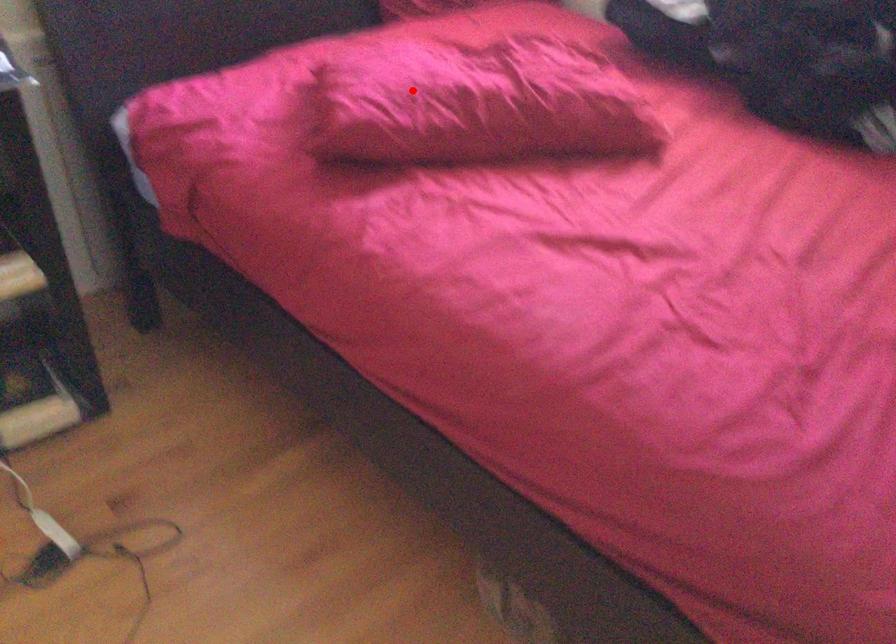
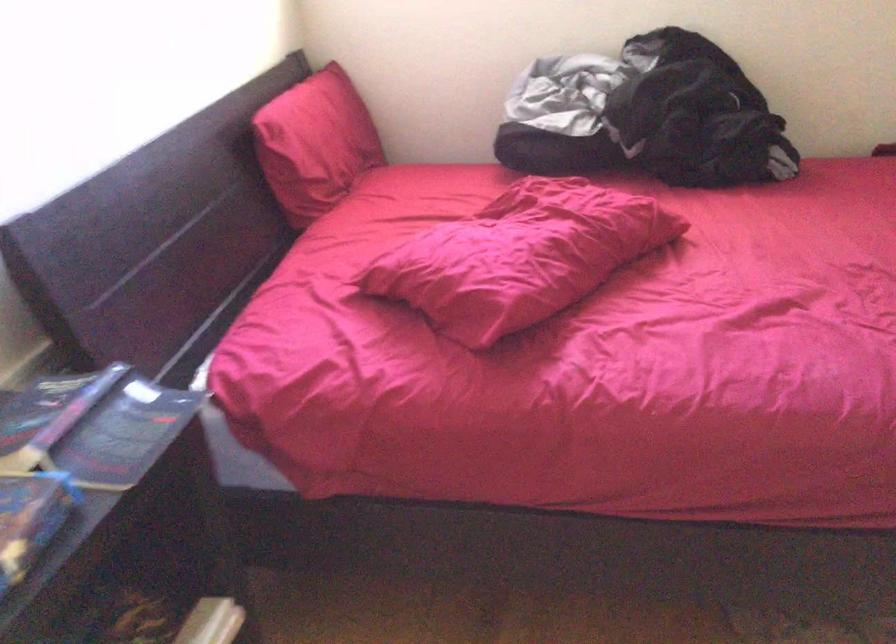
Find the pixel in the second image that matches the highlighted location in the first image.

(520, 257)